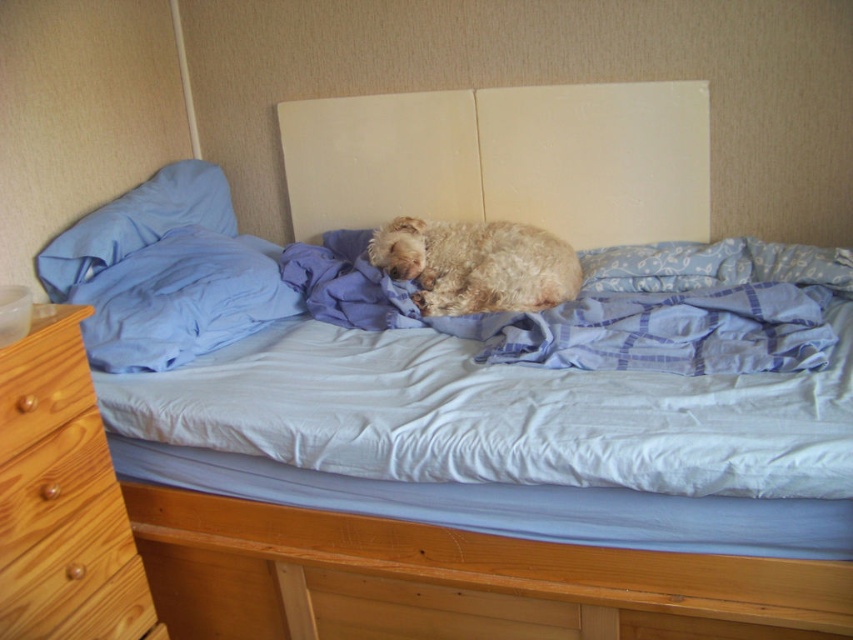
In the scene described, where is the blue plaid fabric at center located in terms of coordinates?

The blue plaid fabric at center is located at coordinates point (590, 316).

You are arranging a room and need to place a new lamp on the side closest to the blue fabric pillow at left. Which side of the light brown wood dresser at lower left should you place it on?

The blue fabric pillow at left is to the right of the light brown wood dresser at lower left, so the lamp should be placed on the right side of the light brown wood dresser at lower left.